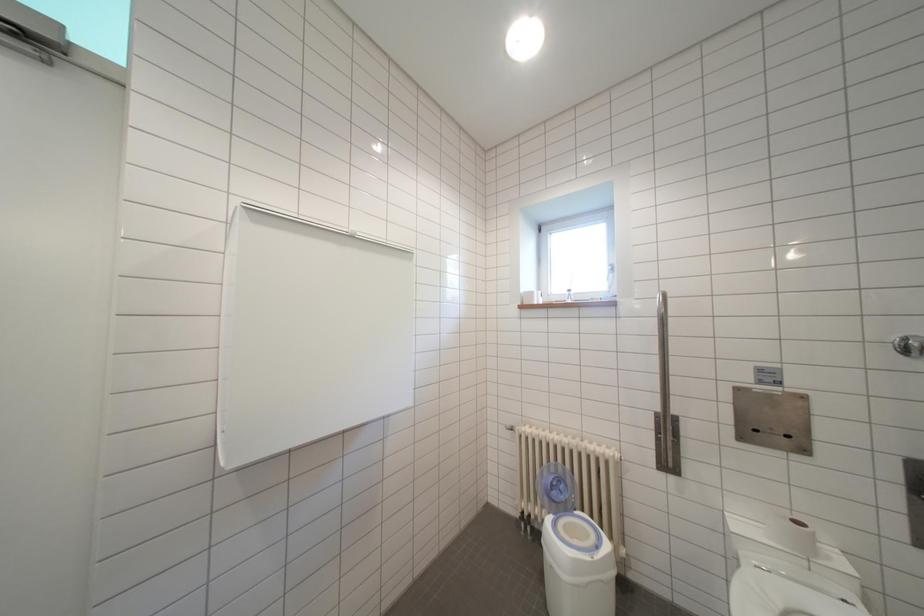
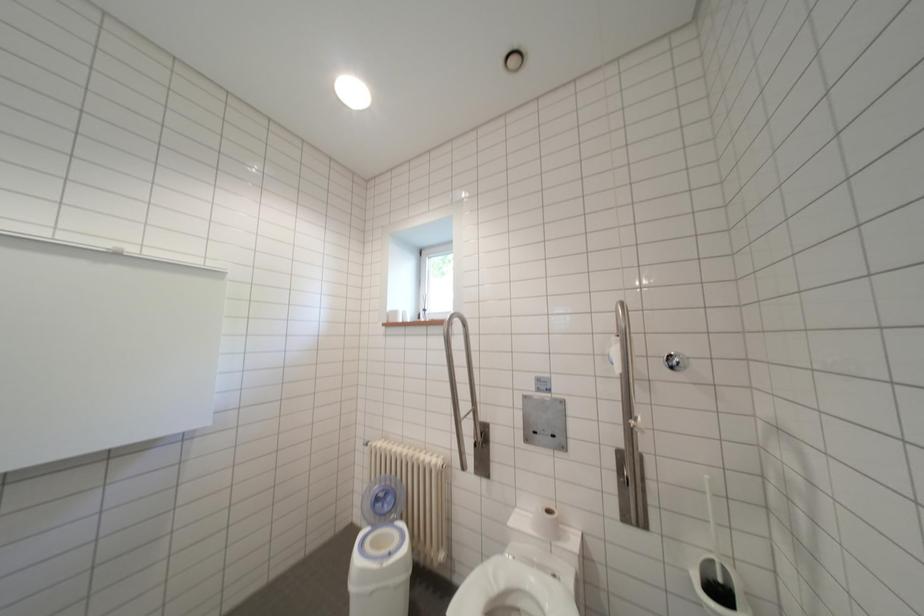
Question: The camera is either moving clockwise (left) or counter-clockwise (right) around the object. The first image is from the beginning of the video and the second image is from the end. Is the camera moving left or right when shooting the video?

Choices:
 (A) Left
 (B) Right

Answer: (A)